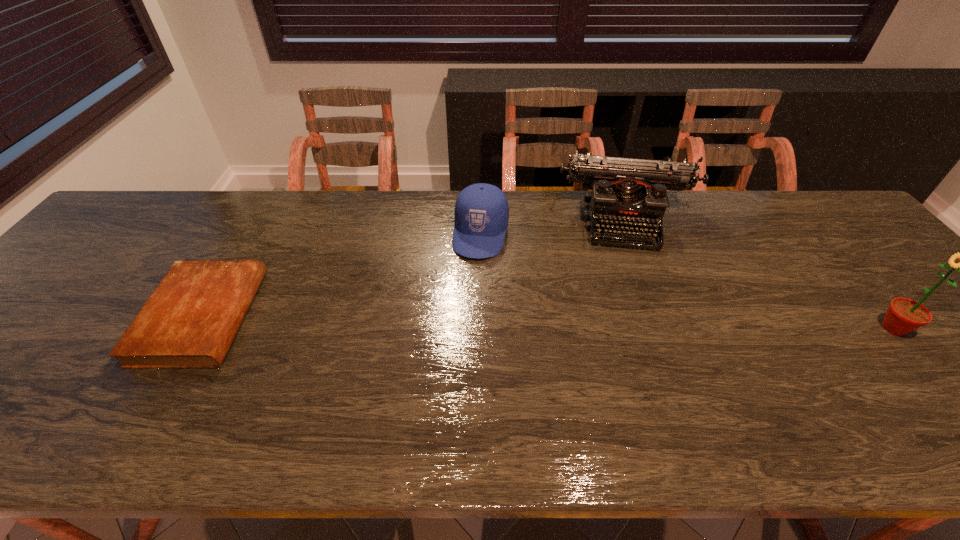
Image resolution: width=960 pixels, height=540 pixels. In order to click on the leftmost object in this screenshot , I will do `click(190, 320)`.

I want to click on the shortest object, so click(x=190, y=320).

Locate an element on the screen. The width and height of the screenshot is (960, 540). the rightmost object is located at coordinates (904, 315).

At what (x,y) coordinates should I click in order to perform the action: click on sunflower. Please return your answer as a coordinate pair (x, y). Looking at the image, I should click on (904, 315).

I want to click on typewriter, so pos(631,193).

Identify the location of the third object from left to right. The width and height of the screenshot is (960, 540). (631, 193).

Locate an element on the screen. This screenshot has width=960, height=540. the third tallest object is located at coordinates (481, 215).

Identify the location of cap. The height and width of the screenshot is (540, 960). (481, 215).

Locate an element on the screen. This screenshot has width=960, height=540. free space located 0.290m on the spine side of the leftmost object is located at coordinates (369, 316).

At what (x,y) coordinates should I click in order to perform the action: click on vacant area situated 0.100m on the face of the rightmost object. Please return your answer as a coordinate pair (x, y). Image resolution: width=960 pixels, height=540 pixels. Looking at the image, I should click on tap(834, 328).